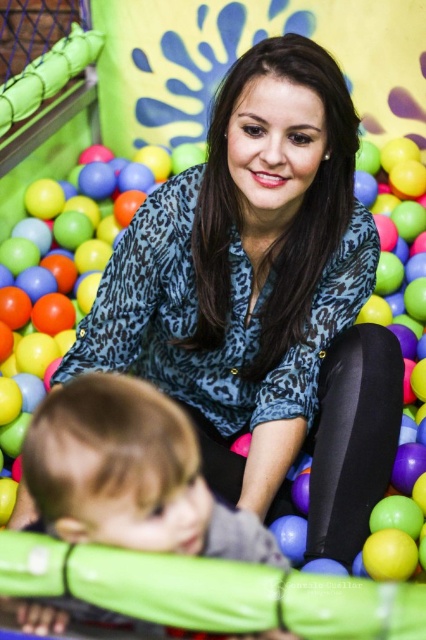
Does leopard print blouse at center have a lesser width compared to matte plastic ball at center?

Incorrect, leopard print blouse at center's width is not less than matte plastic ball at center's.

From the picture: Between leopard print blouse at center and matte plastic ball at center, which one appears on the right side from the viewer's perspective?

Positioned to the right is leopard print blouse at center.

Identify the location of leopard print blouse at center. The width and height of the screenshot is (426, 640). click(264, 298).

Where is `leopard print blouse at center`? The image size is (426, 640). leopard print blouse at center is located at coordinates (264, 298).

Can you confirm if leopard print blouse at center is thinner than blonde hair toddler at center?

No, leopard print blouse at center is not thinner than blonde hair toddler at center.

Is point (184, 173) positioned in front of point (117, 497)?

No, (184, 173) is further to viewer.

At what (x,y) coordinates should I click in order to perform the action: click on leopard print blouse at center. Please return your answer as a coordinate pair (x, y). This screenshot has width=426, height=640. Looking at the image, I should click on (264, 298).

Who is more forward, (149,460) or (149,298)?

Point (149,460) is more forward.

Does blonde hair toddler at center appear under matte plastic ball at center?

Yes, blonde hair toddler at center is below matte plastic ball at center.

Is point (218, 508) farther from camera compared to point (131, 241)?

No.

Where is `blonde hair toddler at center`? This screenshot has height=640, width=426. blonde hair toddler at center is located at coordinates (131, 474).